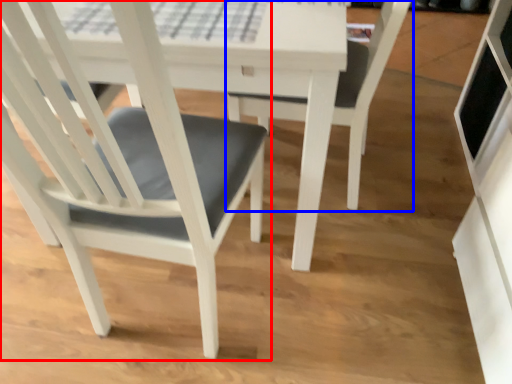
Question: Which object appears farthest to the camera in this image, chair (highlighted by a red box) or chair (highlighted by a blue box)?

Choices:
 (A) chair
 (B) chair

Answer: (B)